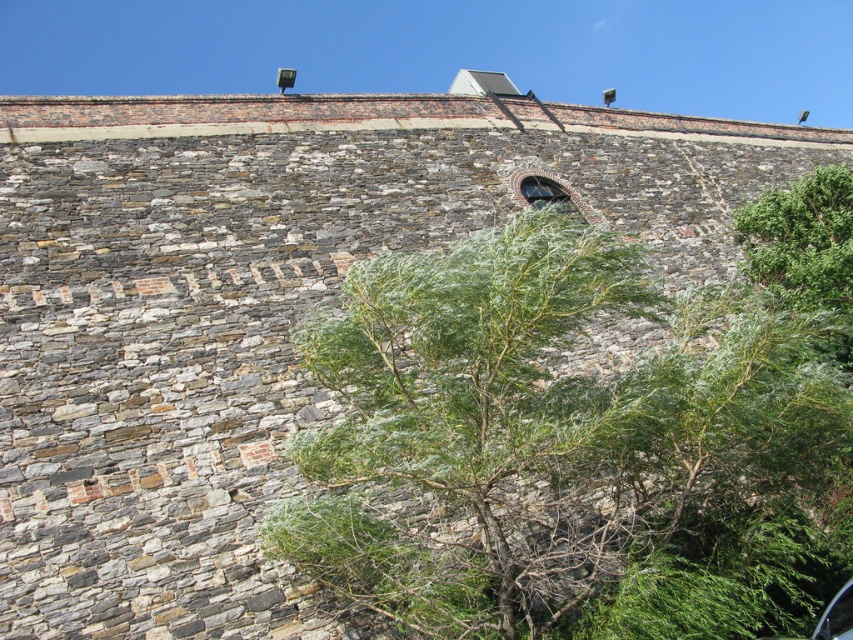
Question: Which point is farther from the camera taking this photo?

Choices:
 (A) (556, 426)
 (B) (772, 198)

Answer: (B)

Question: Where is green leafy tree at center located in relation to green leafy bush at upper right in the image?

Choices:
 (A) below
 (B) above

Answer: (A)

Question: Does green leafy tree at center appear on the right side of green leafy bush at upper right?

Choices:
 (A) yes
 (B) no

Answer: (B)

Question: Does green leafy tree at center have a lesser width compared to green leafy bush at upper right?

Choices:
 (A) no
 (B) yes

Answer: (A)